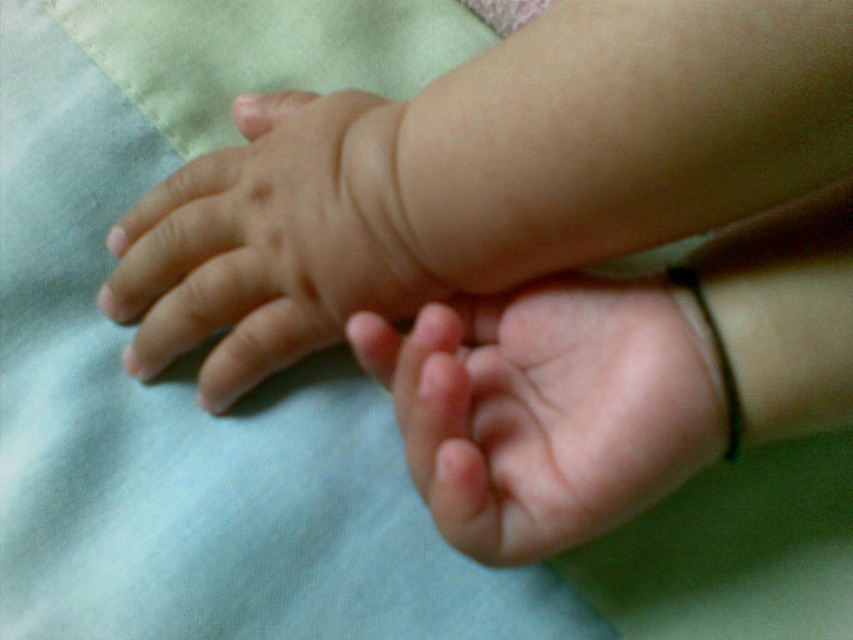
Question: Which is farther from the pink soft skin at center?

Choices:
 (A) smooth skin hand at upper left
 (B) smooth skin hand at center

Answer: (A)

Question: Is smooth skin hand at upper left positioned at the back of pink soft skin at center?

Choices:
 (A) yes
 (B) no

Answer: (A)

Question: Does smooth skin hand at center have a larger size compared to pink soft skin at center?

Choices:
 (A) no
 (B) yes

Answer: (B)

Question: Is smooth skin hand at center smaller than smooth skin hand at upper left?

Choices:
 (A) yes
 (B) no

Answer: (A)

Question: Which object is farther from the camera taking this photo?

Choices:
 (A) smooth skin hand at center
 (B) smooth skin hand at upper left
 (C) pink soft skin at center

Answer: (B)

Question: Which of these objects is positioned closest to the pink soft skin at center?

Choices:
 (A) smooth skin hand at center
 (B) smooth skin hand at upper left

Answer: (A)